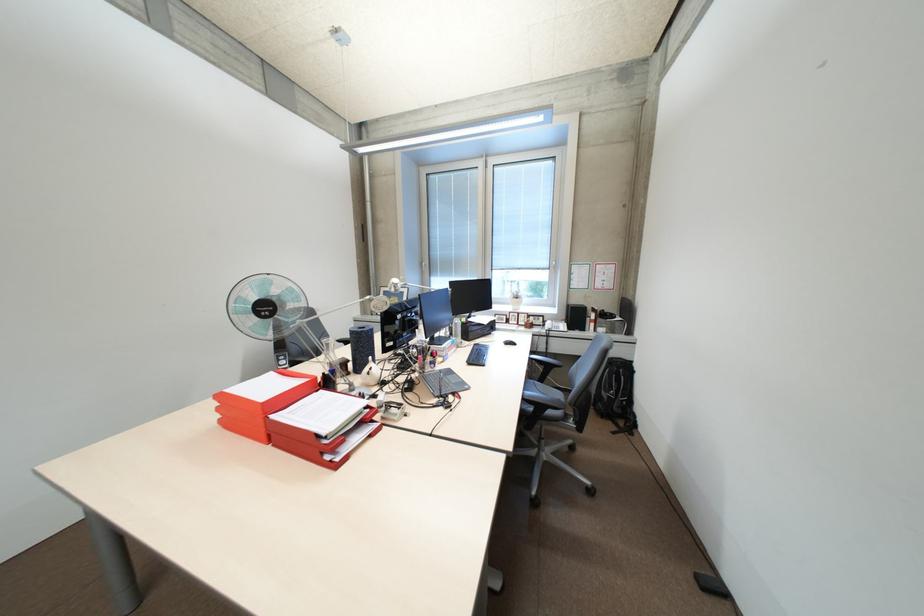
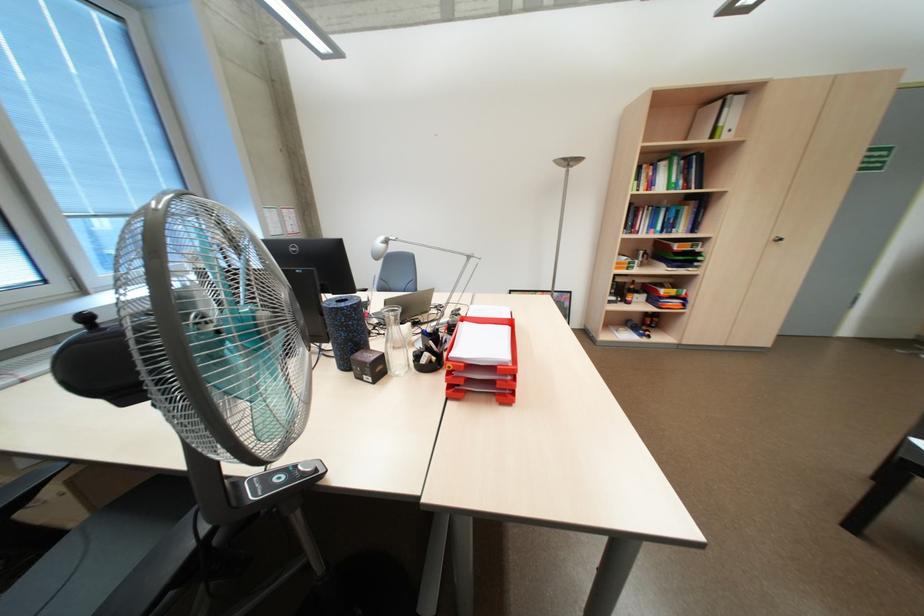
Question: I am providing you with two images of the same scene from different viewpoints. Please identify which objects are invisible in image2.

Choices:
 (A) cabinet door handle
 (B) black computer mouse
 (C) fan control button
 (D) pink dispenser pump

Answer: (B)